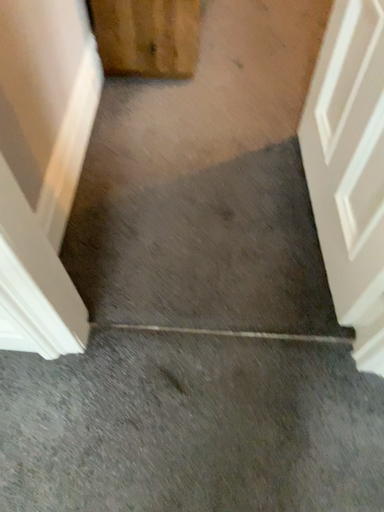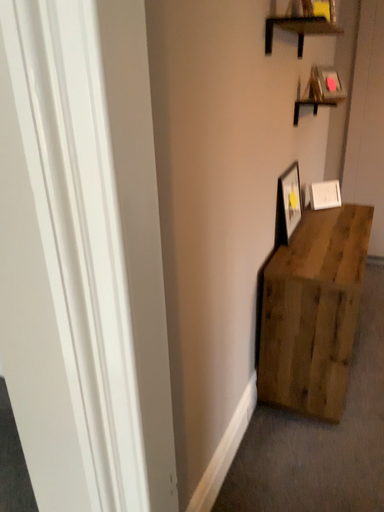
Question: How did the camera likely rotate when shooting the video?

Choices:
 (A) rotated upward
 (B) rotated downward

Answer: (A)